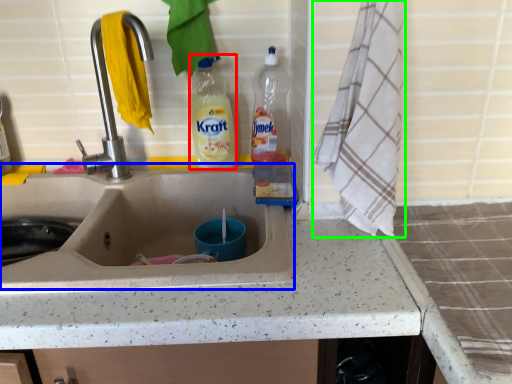
Question: Based on their relative distances, which object is farther from bottle (highlighted by a red box)? Choose from sink (highlighted by a blue box) and bath towel (highlighted by a green box).

Choices:
 (A) sink
 (B) bath towel

Answer: (B)